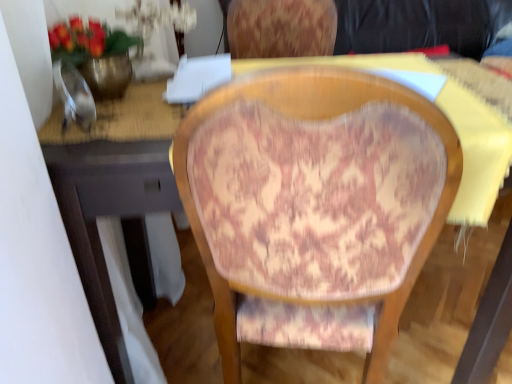
Question: From a real-world perspective, is patterned fabric chair at center positioned above or below metallic gold vase at upper left?

Choices:
 (A) above
 (B) below

Answer: (B)

Question: From the image's perspective, is patterned fabric chair at center positioned above or below metallic gold vase at upper left?

Choices:
 (A) above
 (B) below

Answer: (B)

Question: Based on their positions, is patterned fabric chair at center located to the left or right of metallic gold vase at upper left?

Choices:
 (A) right
 (B) left

Answer: (A)

Question: In the image, is metallic gold vase at upper left positioned in front of or behind patterned fabric chair at center?

Choices:
 (A) front
 (B) behind

Answer: (B)

Question: Is metallic gold vase at upper left bigger or smaller than patterned fabric chair at center?

Choices:
 (A) big
 (B) small

Answer: (B)

Question: From the image's perspective, relative to patterned fabric chair at center, is metallic gold vase at upper left above or below?

Choices:
 (A) below
 (B) above

Answer: (B)

Question: Is metallic gold vase at upper left inside the boundaries of patterned fabric chair at center, or outside?

Choices:
 (A) outside
 (B) inside

Answer: (A)